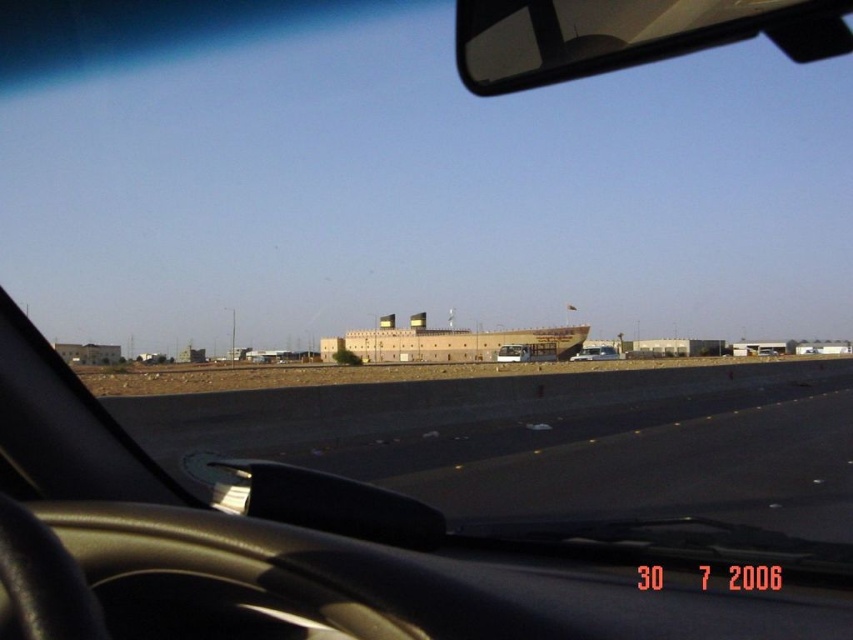
Question: Can you confirm if transparent plastic view mirror at upper center is thinner than matte black car at center?

Choices:
 (A) yes
 (B) no

Answer: (B)

Question: Estimate the real-world distances between objects in this image. Which object is closer to the transparent plastic view mirror at upper center?

Choices:
 (A) matte black car at center
 (B) white matte van at center

Answer: (A)

Question: Can you confirm if white matte van at center is bigger than matte black car at center?

Choices:
 (A) no
 (B) yes

Answer: (B)

Question: Is transparent plastic view mirror at upper center to the right of white matte van at center from the viewer's perspective?

Choices:
 (A) yes
 (B) no

Answer: (B)

Question: Which is nearer to the white matte van at center?

Choices:
 (A) matte black car at center
 (B) transparent plastic view mirror at upper center

Answer: (A)

Question: Which of the following is the closest to the observer?

Choices:
 (A) transparent plastic view mirror at upper center
 (B) white matte van at center

Answer: (A)